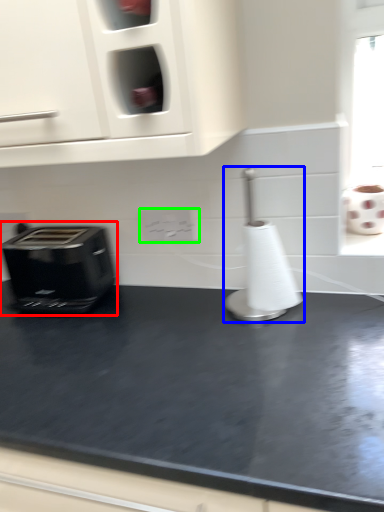
Question: Considering the real-world distances, which object is closest to toaster (highlighted by a red box)? appliance (highlighted by a blue box) or electric outlet (highlighted by a green box).

Choices:
 (A) appliance
 (B) electric outlet

Answer: (B)